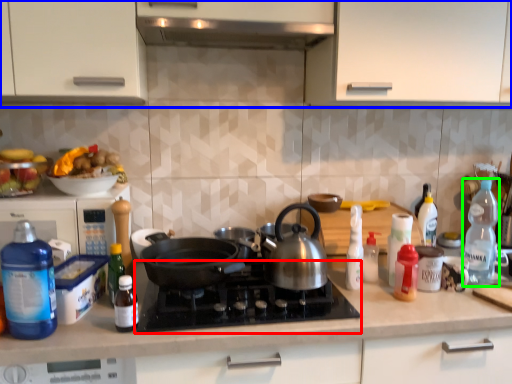
Question: Considering the real-world distances, which object is farthest from gas stove (highlighted by a red box)? cabinetry (highlighted by a blue box) or bottle (highlighted by a green box)?

Choices:
 (A) cabinetry
 (B) bottle

Answer: (B)